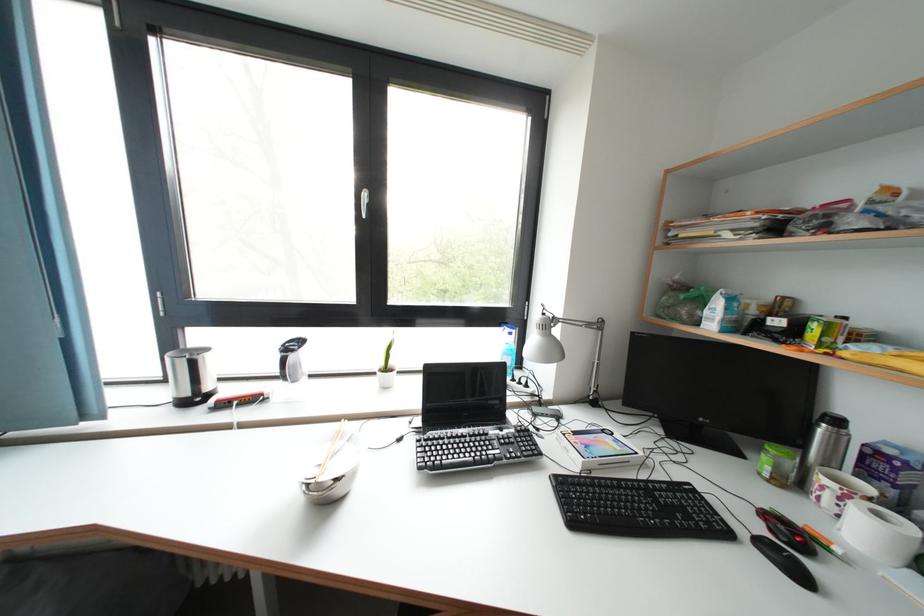
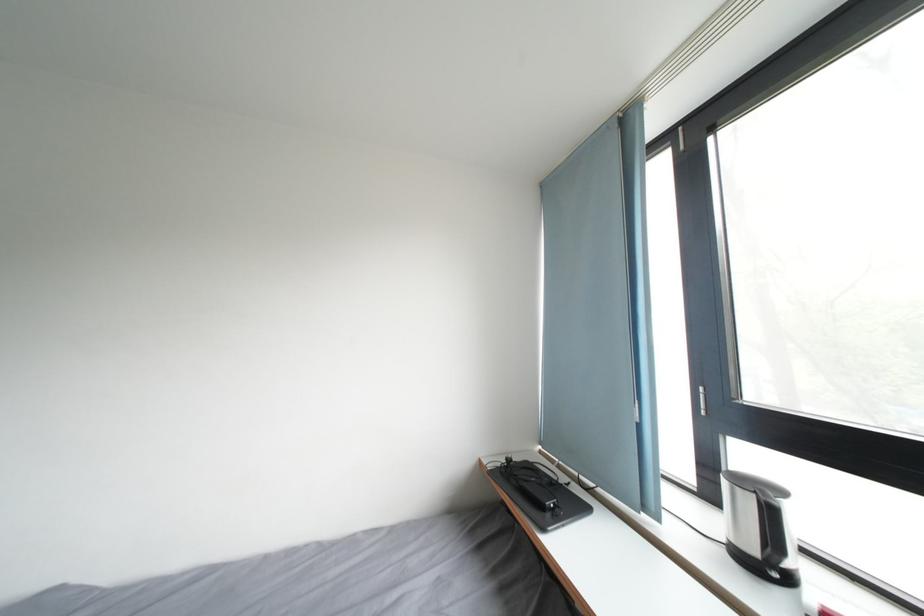
Question: The first image is from the beginning of the video and the second image is from the end. How did the camera likely rotate when shooting the video?

Choices:
 (A) Left
 (B) Right
 (C) Up
 (D) Down

Answer: (A)